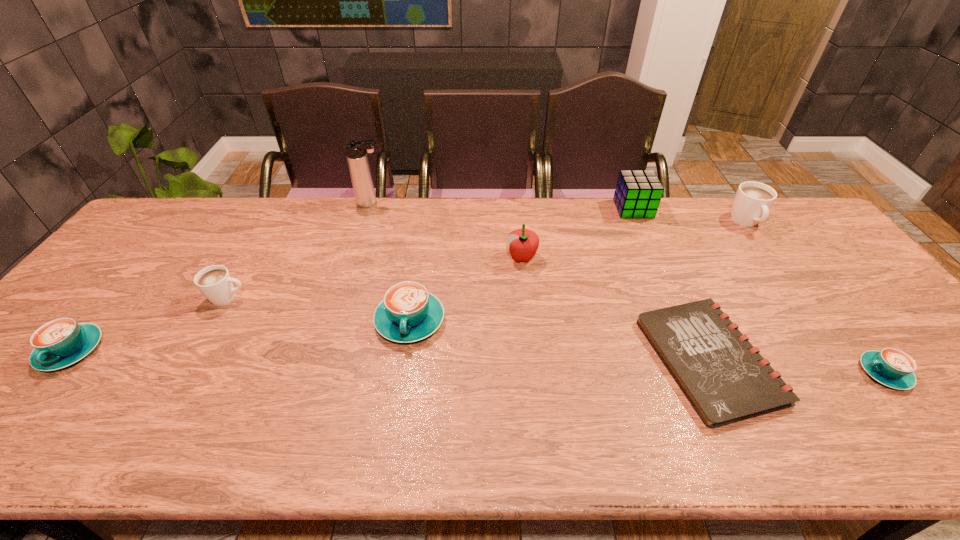
Identify the location of the left white cappuccino. (215, 282).

Locate an element on the screen. This screenshot has height=540, width=960. the leftmost turquoise cappuccino is located at coordinates (62, 342).

You are a GUI agent. You are given a task and a screenshot of the screen. Output one action in this format:
    pyautogui.click(x=<x>, y=<y>)
    Task: Click on the seventh tallest object
    The width and height of the screenshot is (960, 540).
    Given the screenshot: What is the action you would take?
    pyautogui.click(x=62, y=342)

Where is `the smallest turquoise cappuccino`? The image size is (960, 540). the smallest turquoise cappuccino is located at coordinates (891, 367).

Identify the location of the eighth tallest object. This screenshot has width=960, height=540. (891, 367).

Image resolution: width=960 pixels, height=540 pixels. In order to click on notebook in this screenshot , I will do `click(724, 377)`.

The image size is (960, 540). Find the location of `free location located 0.360m on the handle side of the tallest object`. free location located 0.360m on the handle side of the tallest object is located at coordinates (491, 203).

The height and width of the screenshot is (540, 960). Find the location of `free location located on the right of the cube`. free location located on the right of the cube is located at coordinates (685, 209).

Find the location of a particular element. free space located 0.230m on the front of the apple is located at coordinates (529, 330).

The width and height of the screenshot is (960, 540). Find the location of `vacant space situated 0.160m with the handle on the side of the tallest cappuccino`. vacant space situated 0.160m with the handle on the side of the tallest cappuccino is located at coordinates coord(780,271).